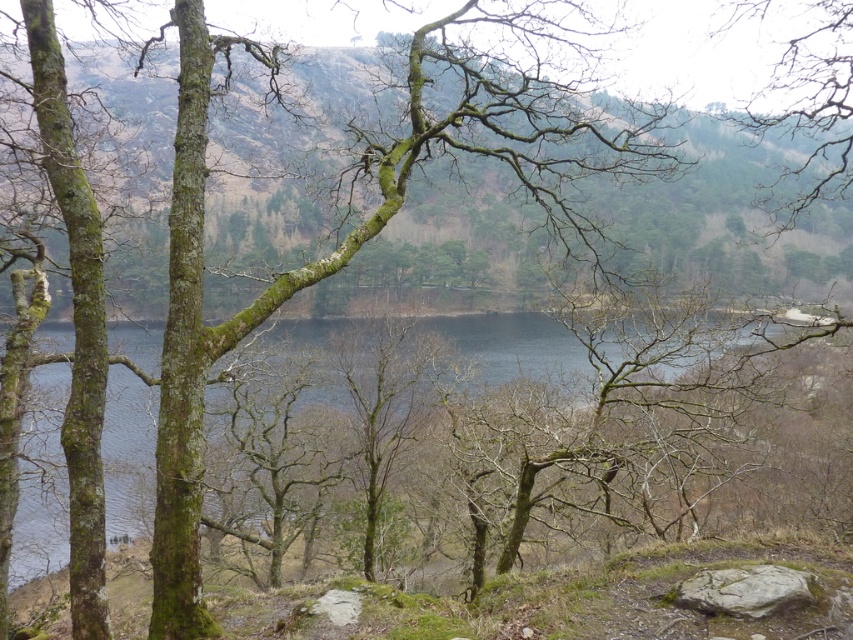
Question: Among these objects, which one is farthest from the camera?

Choices:
 (A) dark blue water at center
 (B) gray rough rock at lower right

Answer: (A)

Question: Does dark blue water at center appear on the right side of gray rough rock at lower right?

Choices:
 (A) yes
 (B) no

Answer: (B)

Question: Can you confirm if dark blue water at center is positioned to the left of gray rough rock at lower right?

Choices:
 (A) yes
 (B) no

Answer: (A)

Question: Considering the relative positions of dark blue water at center and gray rough rock at lower right in the image provided, where is dark blue water at center located with respect to gray rough rock at lower right?

Choices:
 (A) right
 (B) left

Answer: (B)